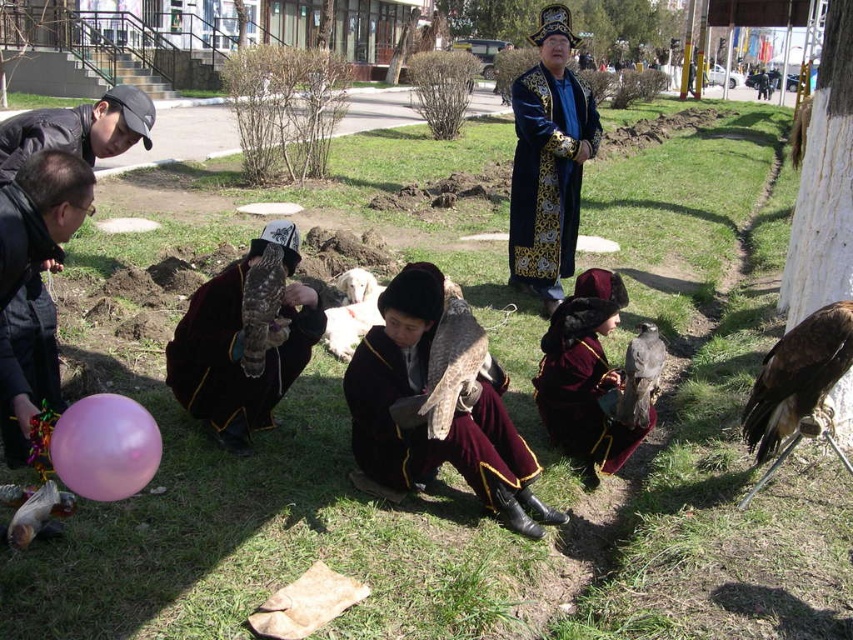
Measure the distance between maroon velvet robe at center and camera.

A distance of 3.10 meters exists between maroon velvet robe at center and camera.

Between maroon velvet robe at center and dark brown feathered falcon at center, which one appears on the left side from the viewer's perspective?

Positioned to the left is maroon velvet robe at center.

Where is `maroon velvet robe at center`? maroon velvet robe at center is located at coordinates (426, 422).

Does maroon velvet coat at center appear over black matte balloon at lower left?

Actually, maroon velvet coat at center is below black matte balloon at lower left.

Is maroon velvet coat at center to the left of black matte balloon at lower left from the viewer's perspective?

In fact, maroon velvet coat at center is to the right of black matte balloon at lower left.

Based on the photo, measure the distance between maroon velvet coat at center and camera.

maroon velvet coat at center is 3.66 meters away from camera.

Image resolution: width=853 pixels, height=640 pixels. Find the location of `maroon velvet coat at center`. maroon velvet coat at center is located at coordinates (589, 378).

Between dark blue velvet robe at upper center and velvet maroon robe at center, which one is positioned lower?

velvet maroon robe at center

Is point (555, 26) positioned after point (238, 392)?

That is True.

Is point (569, 13) less distant than point (218, 392)?

No, (569, 13) is further to viewer.

This screenshot has height=640, width=853. I want to click on dark blue velvet robe at upper center, so click(548, 161).